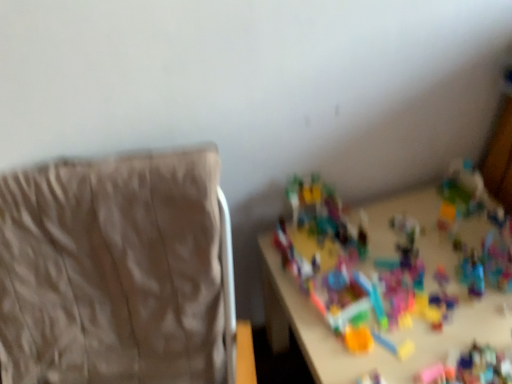
You are a GUI agent. You are given a task and a screenshot of the screen. Output one action in this format:
    pyautogui.click(x=<x>, y=<y>)
    Task: Click on the vacant area on top of multicolored plastic toys at center (from a real-world perspective)
    This screenshot has width=512, height=384.
    Given the screenshot: What is the action you would take?
    pyautogui.click(x=403, y=276)